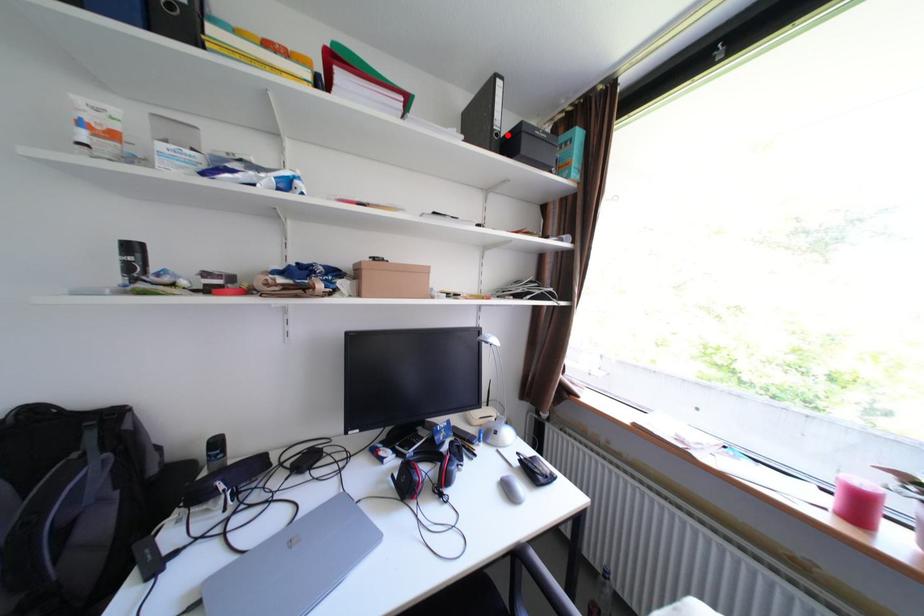
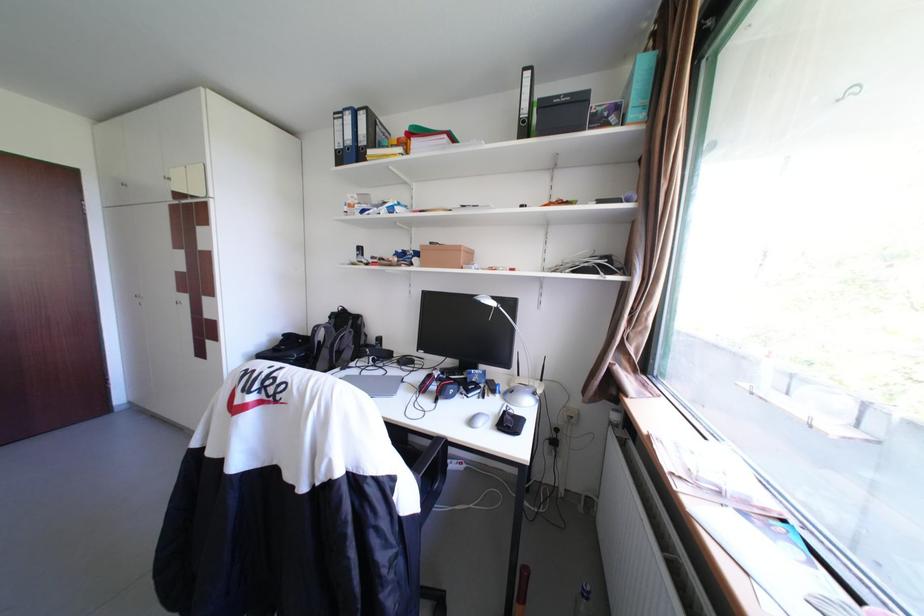
In the second image, find the point that corresponds to the highlighted location in the first image.

(535, 122)